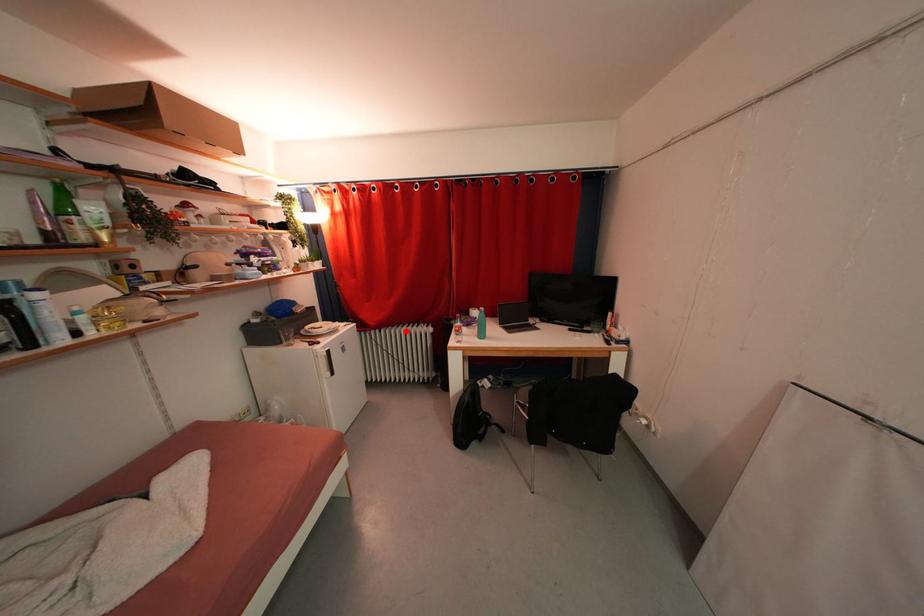
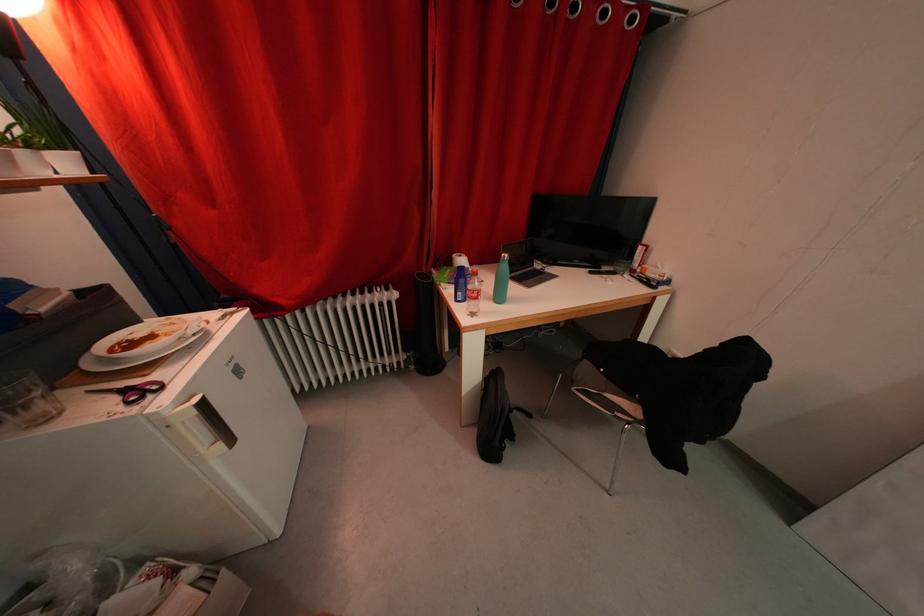
Locate, in the second image, the point that corresponds to the highlighted location in the first image.

(346, 302)